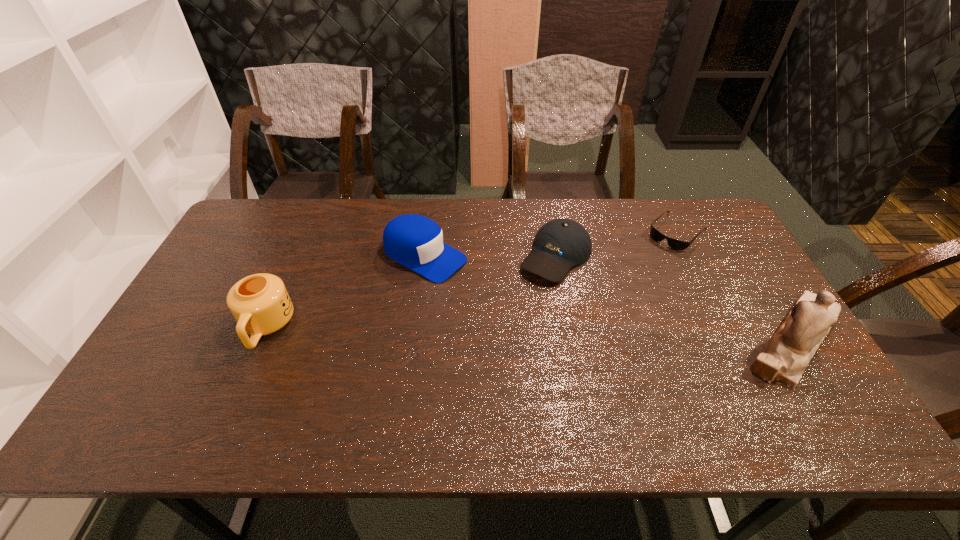
The width and height of the screenshot is (960, 540). Identify the location of blank region between the third tallest object and the figurine. (610, 298).

The width and height of the screenshot is (960, 540). What are the coordinates of `unoccupied position between the leftmost object and the tallest object` in the screenshot? It's located at (531, 334).

This screenshot has height=540, width=960. I want to click on vacant space that is in between the figurine and the fourth shortest object, so click(531, 334).

The height and width of the screenshot is (540, 960). What are the coordinates of `unoccupied area between the third shortest object and the second tallest object` in the screenshot? It's located at (346, 292).

Identify the location of free spot between the second tallest object and the taller baseball cap. (346, 292).

At what (x,y) coordinates should I click in order to perform the action: click on vacant area that lies between the right baseball cap and the third tallest object. Please return your answer as a coordinate pair (x, y). Looking at the image, I should click on [x=491, y=256].

Identify the location of free space between the third object from left to right and the left baseball cap. The height and width of the screenshot is (540, 960). (491, 256).

Locate an element on the screen. free spot between the shortest object and the right baseball cap is located at coordinates (616, 244).

Where is `object that is the second closest to the right baseball cap`? This screenshot has height=540, width=960. object that is the second closest to the right baseball cap is located at coordinates (676, 244).

Identify which object is the fourth closest to the figurine. Please provide its 2D coordinates. Your answer should be formatted as a tuple, i.e. [(x, y)], where the tuple contains the x and y coordinates of a point satisfying the conditions above.

[(260, 303)]